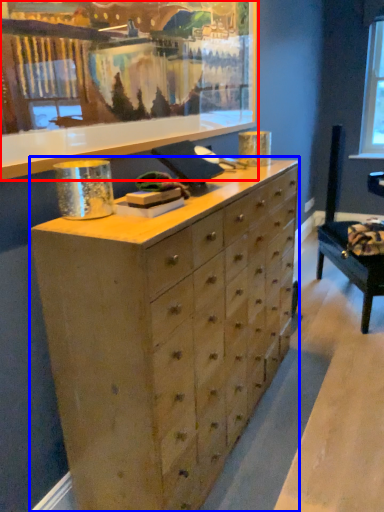
Question: Which of the following is the farthest to the observer, picture frame (highlighted by a red box) or chest of drawers (highlighted by a blue box)?

Choices:
 (A) picture frame
 (B) chest of drawers

Answer: (B)